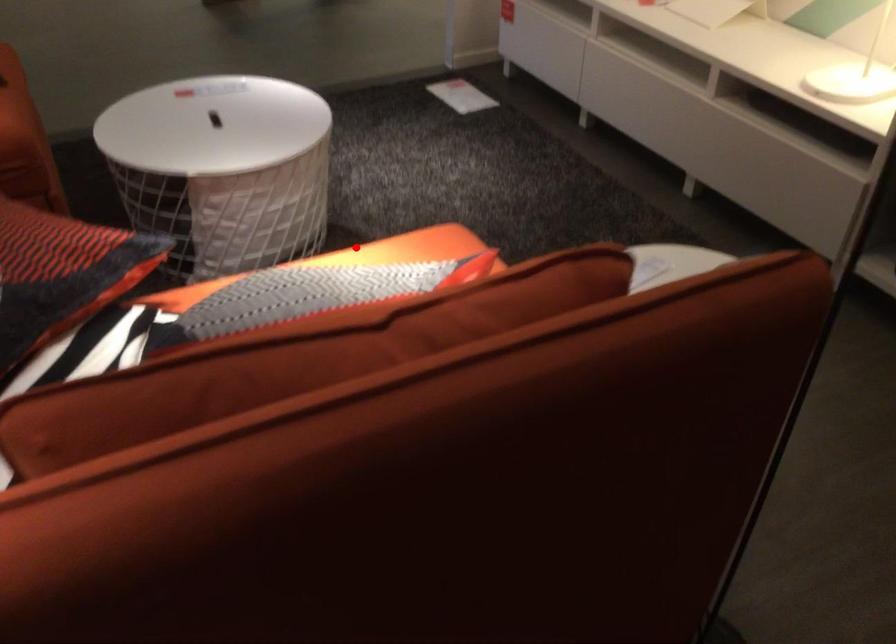
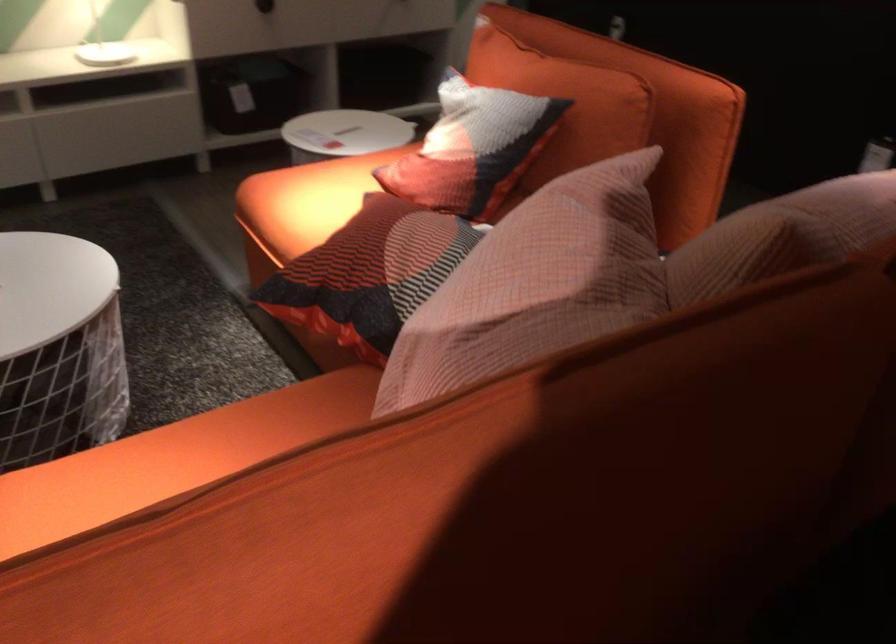
Question: I am providing you with two images of the same scene from different viewpoints. A red point is shown in image1. For the corresponding object point in image2, is it positioned nearer or farther from the camera?

Choices:
 (A) Nearer
 (B) Farther

Answer: (B)